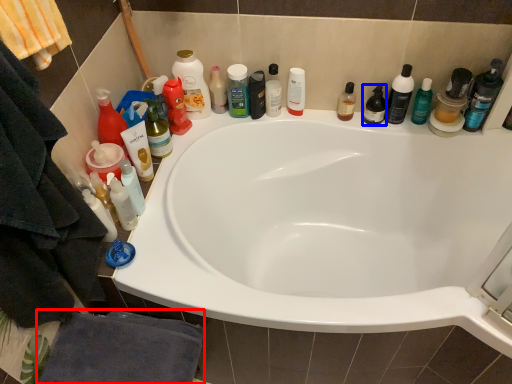
Question: Among these objects, which one is nearest to the camera, bath towel (highlighted by a red box) or toiletry (highlighted by a blue box)?

Choices:
 (A) bath towel
 (B) toiletry

Answer: (A)